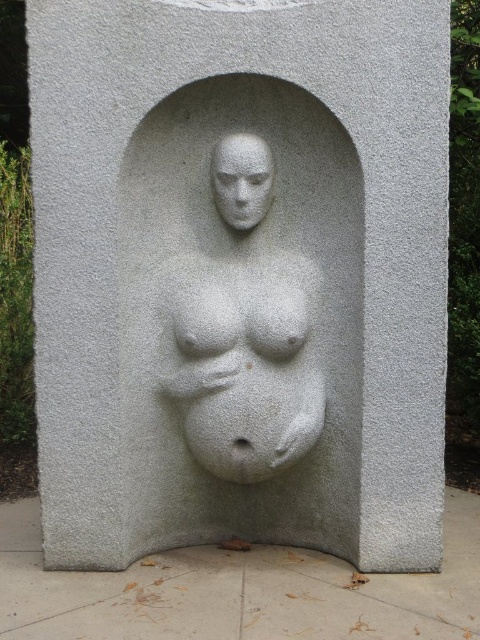
Question: Which point is farther from the camera taking this photo?

Choices:
 (A) (108, 579)
 (B) (251, 275)

Answer: (B)

Question: Can you confirm if white textured stone pregnant figure at center is positioned below white stone face at center?

Choices:
 (A) no
 (B) yes

Answer: (B)

Question: Does gray rough concrete at lower center appear on the right side of white textured stone pregnant figure at center?

Choices:
 (A) yes
 (B) no

Answer: (A)

Question: Is white textured stone pregnant figure at center bigger than white stone face at center?

Choices:
 (A) no
 (B) yes

Answer: (B)

Question: Which object appears farthest from the camera in this image?

Choices:
 (A) gray rough concrete at lower center
 (B) white textured stone pregnant figure at center

Answer: (B)

Question: Which object is farther from the camera taking this photo?

Choices:
 (A) gray rough concrete at lower center
 (B) white textured stone pregnant figure at center
 (C) white stone face at center

Answer: (C)